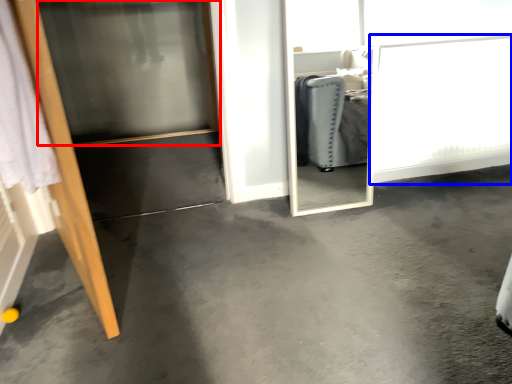
Question: Which of the following is the farthest to the observer, screen door (highlighted by a red box) or screen door (highlighted by a blue box)?

Choices:
 (A) screen door
 (B) screen door

Answer: (B)